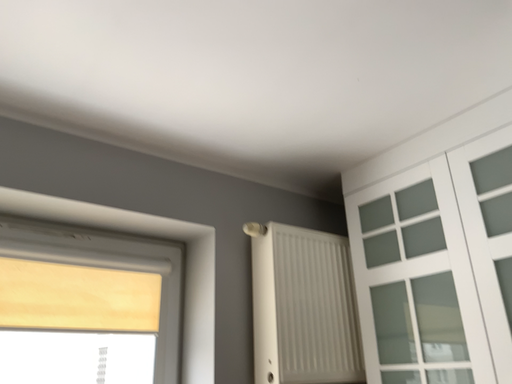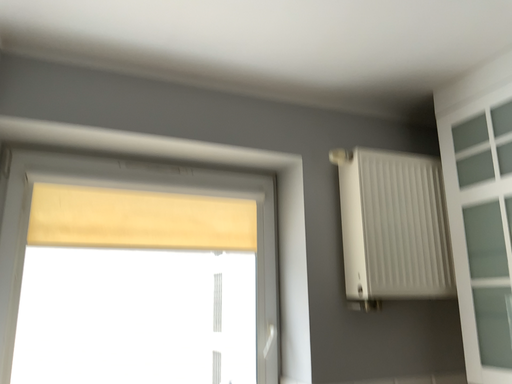
Question: How did the camera likely rotate when shooting the video?

Choices:
 (A) rotated downward
 (B) rotated upward

Answer: (A)